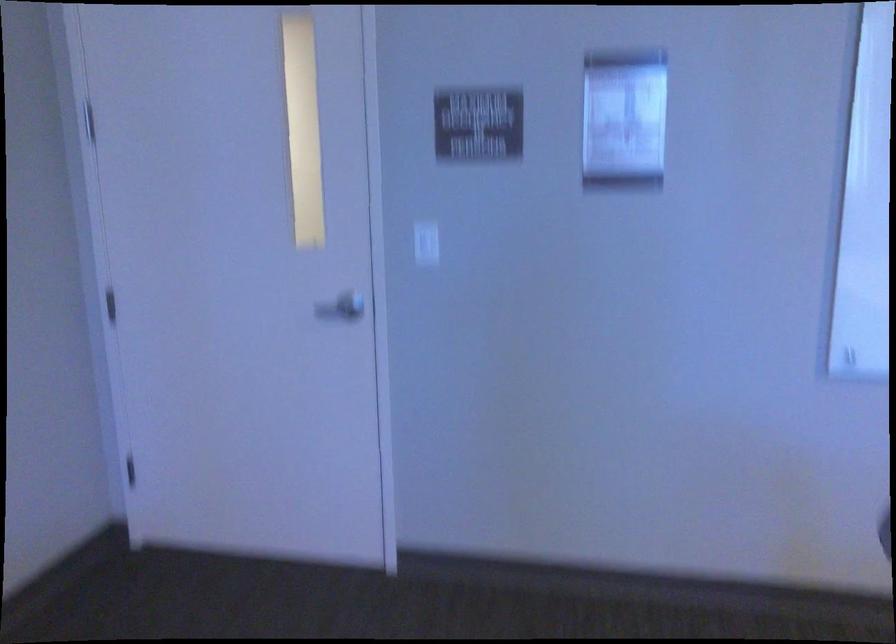
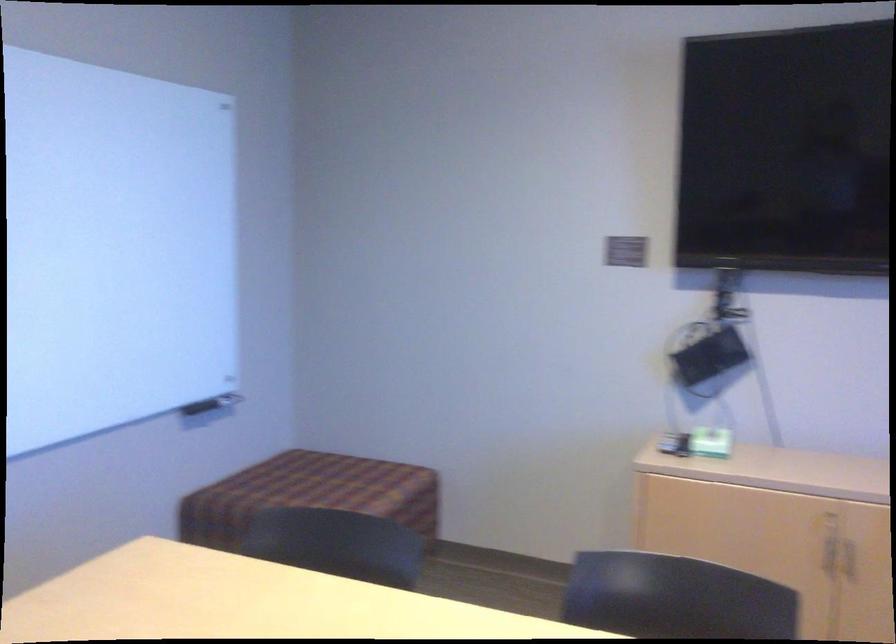
Question: The camera is either moving clockwise (left) or counter-clockwise (right) around the object. The first image is from the beginning of the video and the second image is from the end. Is the camera moving left or right when shooting the video?

Choices:
 (A) Left
 (B) Right

Answer: (A)